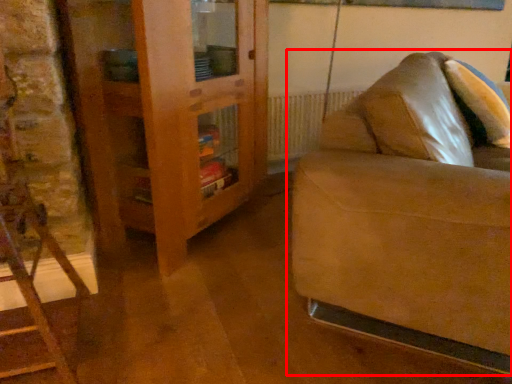
Question: From the image's perspective, what is the correct spatial relationship of studio couch (annotated by the red box) in relation to dresser?

Choices:
 (A) above
 (B) below

Answer: (B)